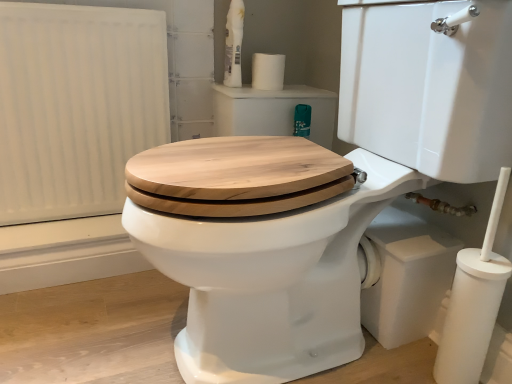
The height and width of the screenshot is (384, 512). I want to click on free space in front of white glossy spray bottle at upper center, so click(240, 87).